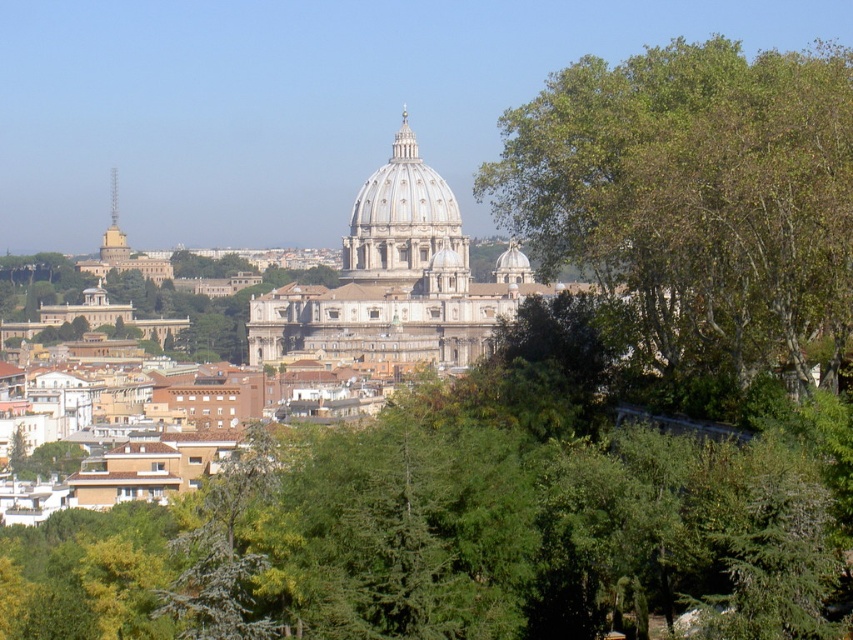
You are standing at the base of the green leafy tree at center in Vatican City. You want to walk to the entrance of St. Peter Basilica, which is 133.70 meters away. If your walking speed is 1.5 meters per second, how long will it take you to reach the basilica entrance?

The distance between the green leafy tree at center and the viewer is 133.70 meters. At a walking speed of 1.5 meters per second, it will take approximately 133.70 divided by 1.5 equals 89.13 seconds, which is roughly 1 minute and 29 seconds to reach the entrance of St. Peter Basilica.

You are standing at point (474, 516) in the cityscape. What can you see directly in front of you?

You can see a green leafy tree at center directly in front of you at point (474, 516).

In the scene shown: You are standing in the city park looking at the green leafy tree at center and the white marble dome at center. Which object would appear larger to you?

The green leafy tree at center appears larger because it is closer to the viewer than the white marble dome at center.